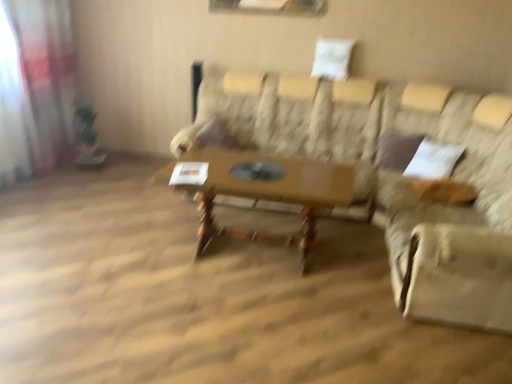
Question: Are patterned fabric couch at center and translucent fabric curtain at left beside each other?

Choices:
 (A) yes
 (B) no

Answer: (B)

Question: Is patterned fabric couch at center at the left side of translucent fabric curtain at left?

Choices:
 (A) no
 (B) yes

Answer: (A)

Question: From a real-world perspective, is patterned fabric couch at center located higher than translucent fabric curtain at left?

Choices:
 (A) no
 (B) yes

Answer: (A)

Question: Is patterned fabric couch at center looking in the opposite direction of translucent fabric curtain at left?

Choices:
 (A) yes
 (B) no

Answer: (B)

Question: Does patterned fabric couch at center come in front of translucent fabric curtain at left?

Choices:
 (A) yes
 (B) no

Answer: (A)

Question: Do you think translucent fabric curtain at left is within wooden table at center, or outside of it?

Choices:
 (A) inside
 (B) outside

Answer: (B)

Question: Considering the relative positions of translucent fabric curtain at left and wooden table at center in the image provided, is translucent fabric curtain at left to the left or to the right of wooden table at center?

Choices:
 (A) left
 (B) right

Answer: (A)

Question: Looking at their shapes, would you say translucent fabric curtain at left is wider or thinner than wooden table at center?

Choices:
 (A) wide
 (B) thin

Answer: (B)

Question: From the image's perspective, is translucent fabric curtain at left positioned above or below wooden table at center?

Choices:
 (A) above
 (B) below

Answer: (A)

Question: Which is correct: wooden table at center is inside beige fabric swivel chair at right, or outside of it?

Choices:
 (A) outside
 (B) inside

Answer: (A)

Question: Does point (267, 243) appear closer or farther from the camera than point (465, 132)?

Choices:
 (A) closer
 (B) farther

Answer: (A)

Question: From a real-world perspective, is wooden table at center above or below beige fabric swivel chair at right?

Choices:
 (A) below
 (B) above

Answer: (A)

Question: From their relative heights in the image, would you say wooden table at center is taller or shorter than beige fabric swivel chair at right?

Choices:
 (A) tall
 (B) short

Answer: (B)

Question: Considering the positions of patterned fabric couch at center and translucent fabric curtain at left in the image, is patterned fabric couch at center wider or thinner than translucent fabric curtain at left?

Choices:
 (A) wide
 (B) thin

Answer: (A)

Question: Considering the relative positions of patterned fabric couch at center and translucent fabric curtain at left in the image provided, is patterned fabric couch at center to the left or to the right of translucent fabric curtain at left?

Choices:
 (A) left
 (B) right

Answer: (B)